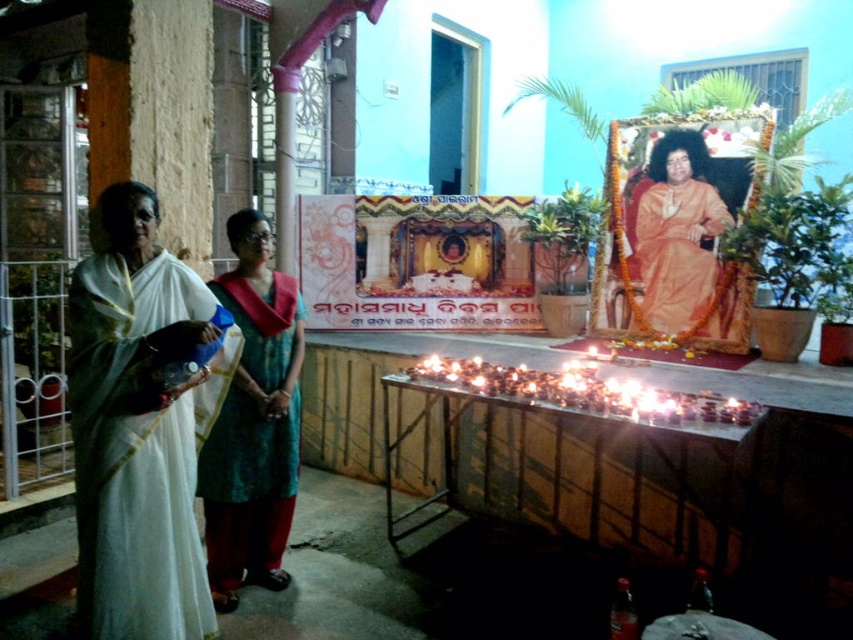
From the picture: You are standing in the temple and need to place a teal silk saree exactly at the center of the room. According to the image, is the teal silk saree at center currently positioned correctly?

The teal silk saree at center is positioned at point (253,420), which is not the exact center of the room. Therefore, it is not correctly placed.

You are a photographer at the temple event. You need to capture a photo that includes both the white silk saree at left and the orange silk saree at center. Based on their positions, which saree should you focus on first to ensure both are in frame?

The white silk saree at left is located below the orange silk saree at center. To capture both in the frame, focus on the orange silk saree at center first as it is higher up, ensuring the lower positioned white silk saree at left also fits into the shot.